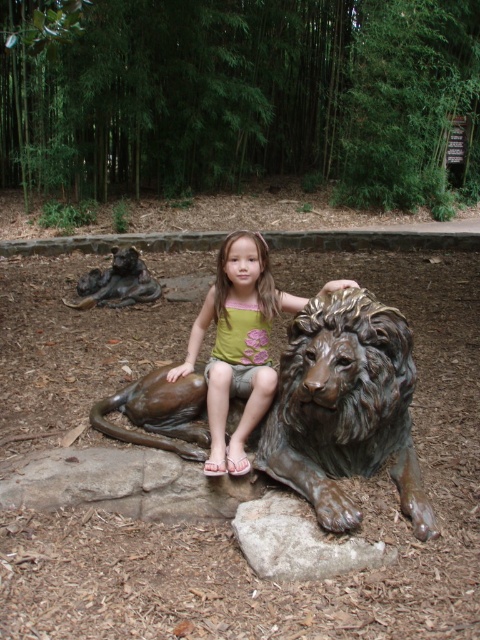
Who is higher up, matte bronze lion at center or gray stone at lower center?

matte bronze lion at center

Which is below, matte bronze lion at center or gray stone at lower center?

gray stone at lower center is below.

Is point (240, 388) positioned before point (372, 557)?

No.

I want to click on matte bronze lion at center, so click(238, 346).

Does bronze lion at center have a smaller size compared to gray stone at lower center?

Actually, bronze lion at center might be larger than gray stone at lower center.

Which is more to the right, bronze lion at center or gray stone at lower center?

gray stone at lower center is more to the right.

Who is more distant from viewer, (x=257, y=428) or (x=331, y=563)?

Point (x=257, y=428)

This screenshot has height=640, width=480. I want to click on bronze lion at center, so click(344, 408).

In the scene shown: Is gray stone at lower center to the right of bronze statue at upper left from the viewer's perspective?

Yes, gray stone at lower center is to the right of bronze statue at upper left.

Which is below, gray stone at lower center or bronze statue at upper left?

gray stone at lower center

Who is more distant from viewer, [290,572] or [146,284]?

Positioned behind is point [146,284].

Identify the location of gray stone at lower center. This screenshot has height=640, width=480. (299, 541).